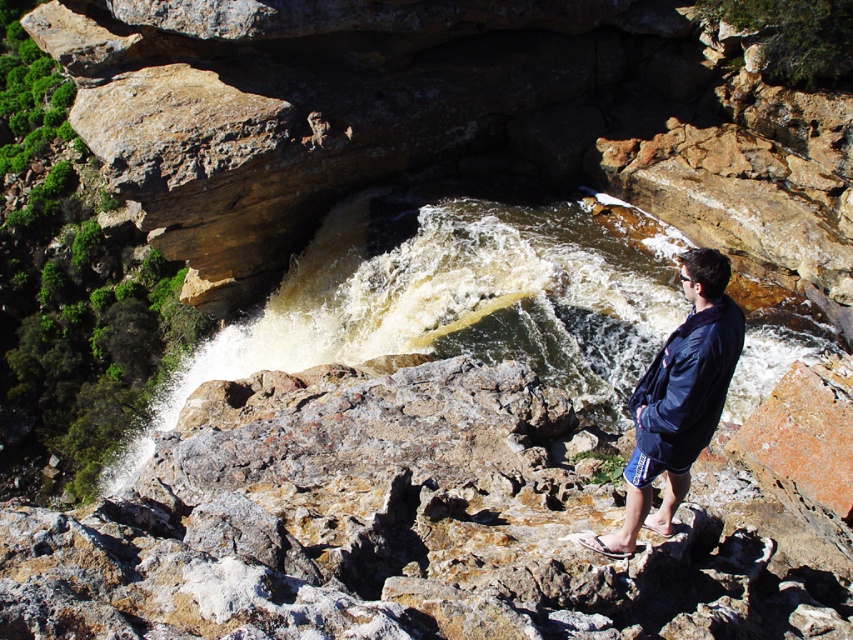
Can you confirm if dark blue fabric at center is positioned to the left of black rubber sandal at lower right?

No, dark blue fabric at center is not to the left of black rubber sandal at lower right.

Which is more to the right, dark blue fabric at center or black rubber sandal at lower right?

dark blue fabric at center is more to the right.

Who is more distant from viewer, (657, 426) or (602, 547)?

The point (602, 547) is behind.

Where is `dark blue fabric at center`? dark blue fabric at center is located at coordinates (680, 396).

Can you confirm if brown/rocky water at center is thinner than black rubber sandal at lower right?

Incorrect, brown/rocky water at center's width is not less than black rubber sandal at lower right's.

Identify the location of brown/rocky water at center. (451, 301).

Locate an element on the screen. brown/rocky water at center is located at coordinates (451, 301).

Does brown/rocky water at center lie in front of dark blue fabric at center?

No, it is behind dark blue fabric at center.

Who is higher up, brown/rocky water at center or dark blue fabric at center?

brown/rocky water at center is above.

Which is behind, point (598, 369) or point (631, 410)?

Positioned behind is point (598, 369).

You are a GUI agent. You are given a task and a screenshot of the screen. Output one action in this format:
    pyautogui.click(x=<x>, y=<y>)
    Task: Click on the brown/rocky water at center
    The height and width of the screenshot is (640, 853).
    Given the screenshot: What is the action you would take?
    pyautogui.click(x=451, y=301)